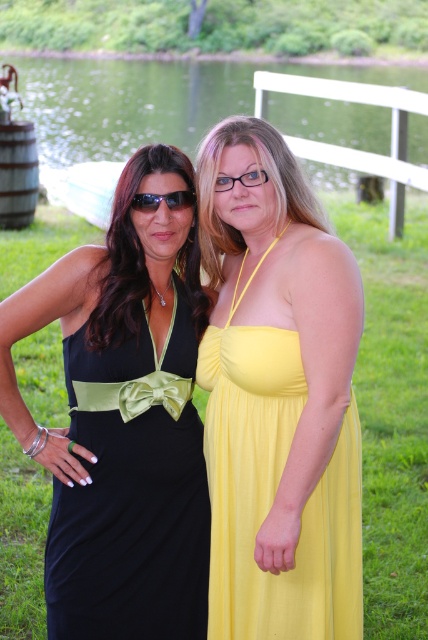
Question: Which point is farther from the camera taking this photo?

Choices:
 (A) (303, 253)
 (B) (169, 68)
 (C) (166, 547)
 (D) (140, 200)

Answer: (B)

Question: Based on their relative distances, which object is nearer to the sunglasses at center?

Choices:
 (A) black satin dress at left
 (B) green grass at lower center

Answer: (A)

Question: Is yellow satin dress at center smaller than green grass at lower center?

Choices:
 (A) yes
 (B) no

Answer: (A)

Question: Can you confirm if yellow satin dress at center is wider than sunglasses at center?

Choices:
 (A) no
 (B) yes

Answer: (B)

Question: Can you confirm if yellow satin dress at center is positioned to the left of sunglasses at center?

Choices:
 (A) yes
 (B) no

Answer: (B)

Question: Among these points, which one is farthest from the camera?

Choices:
 (A) (288, 372)
 (B) (187, 195)

Answer: (B)